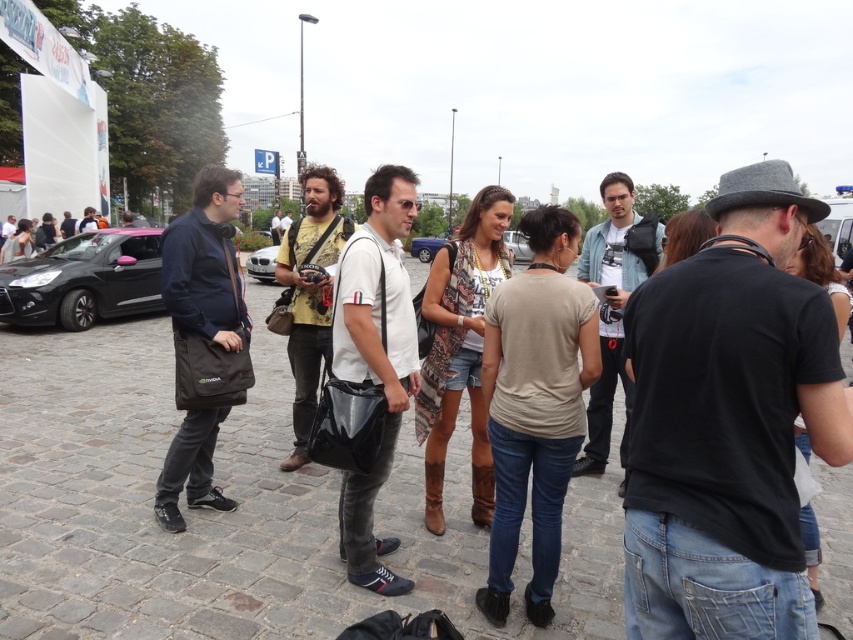
Does black matte car at left appear under metallic blue car at center?

Yes.

Between black matte car at left and metallic blue car at center, which one is positioned higher?

metallic blue car at center is above.

Locate an element on the screen. This screenshot has height=640, width=853. black matte car at left is located at coordinates (84, 280).

The width and height of the screenshot is (853, 640). I want to click on black matte car at left, so click(84, 280).

Between white matte bag at center and silver metallic car at center, which one is positioned lower?

Positioned lower is white matte bag at center.

Is white matte bag at center shorter than silver metallic car at center?

Incorrect, white matte bag at center's height does not fall short of silver metallic car at center's.

Is point (339, 262) positioned after point (254, 275)?

No, it is not.

This screenshot has width=853, height=640. What are the coordinates of `white matte bag at center` in the screenshot? It's located at (375, 358).

Is black cotton t-shirt at center further to camera compared to white matte bag at center?

No, black cotton t-shirt at center is closer to the viewer.

Locate an element on the screen. black cotton t-shirt at center is located at coordinates (728, 422).